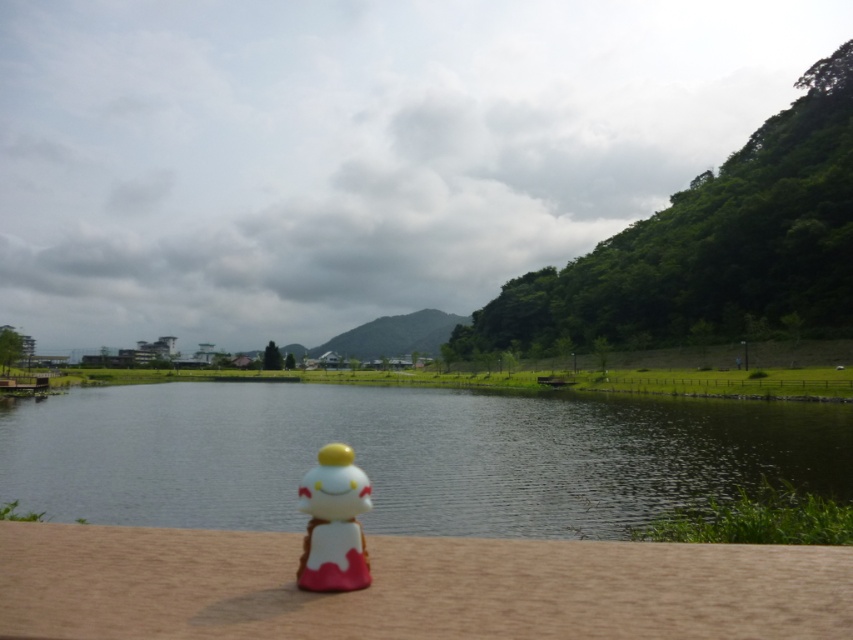
You are standing at the point with coordinates point [338,476] and want to walk to the point with coordinates point [120,417]. Which direction should you face to move towards your destination?

You should face north because point [120,417] is behind point [338,476], meaning it is in the northern direction from your current position.

You are standing at the edge of the lake and want to place a small toy boat in the water. According to the coordinates provided, where should you place the boat to ensure it floats on the transparent water at lake center?

You should place the boat at the coordinates point (x=407, y=456) where the transparent water at lake center is located.

You are standing at the point marked by the coordinates point (407, 456) in the scene. What do you see immediately around you?

The point (407, 456) indicates transparent water at lake center, so you are standing in the transparent water at lake center.